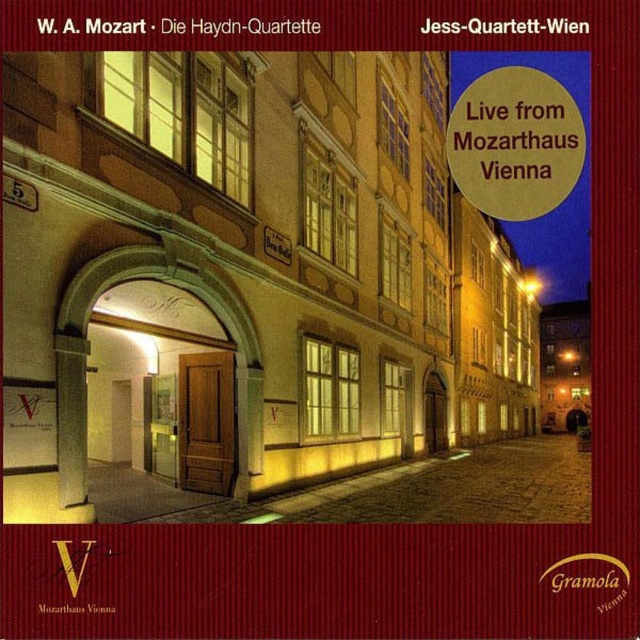
You are standing in front of the Mozarthaus Vienna building. There are two points marked on the building facade. The first point is at coordinates point (x=445, y=266) and the second is at point (x=472, y=97). If you were to throw a small ball towards these points, which point would the ball reach first if you aim directly at them?

The ball would reach point (x=472, y=97) first because it is closer to you than point (x=445, y=266), which is further away.

You are attending the Mozart event and see the beige stone building at center and the gold metallic circle at upper right. Which object is positioned higher in the image?

The gold metallic circle at upper right is positioned higher than the beige stone building at center in the image.

You are standing in front of the Mozarthaus Vienna building. If you want to locate the beige stone building at center, where should you look?

The beige stone building at center is located at point (x=243, y=278).